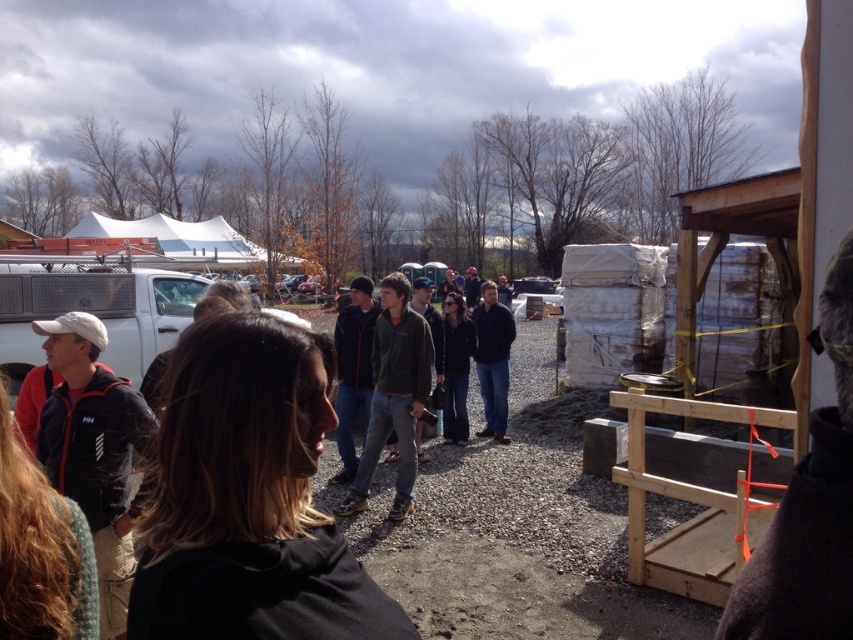
Based on the photo, who is positioned more to the left, green matte jacket at center or dark blue jacket at center?

green matte jacket at center

Who is lower down, green matte jacket at center or dark blue jacket at center?

green matte jacket at center is lower down.

Does point (370, 413) come behind point (503, 342)?

No, it is not.

This screenshot has width=853, height=640. I want to click on green matte jacket at center, so click(x=393, y=396).